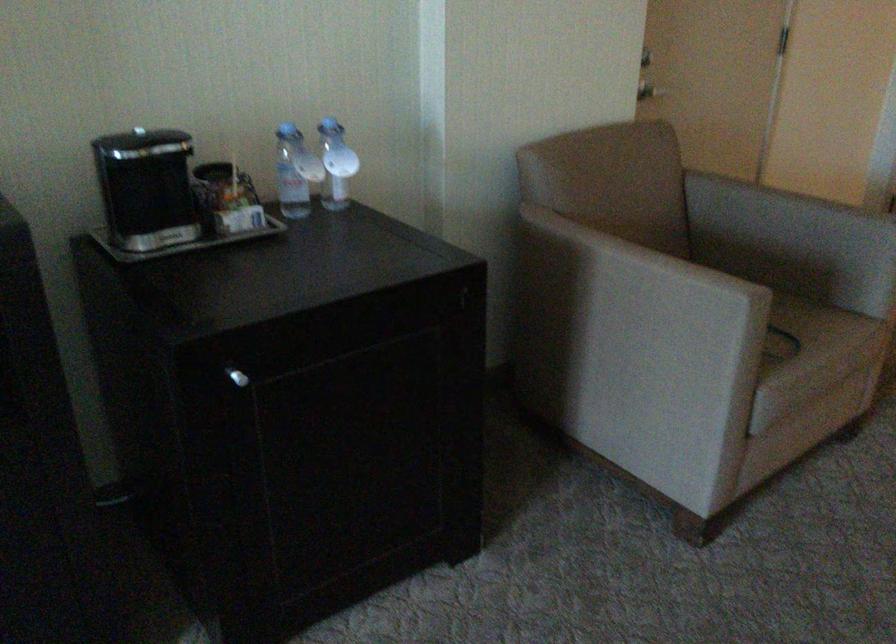
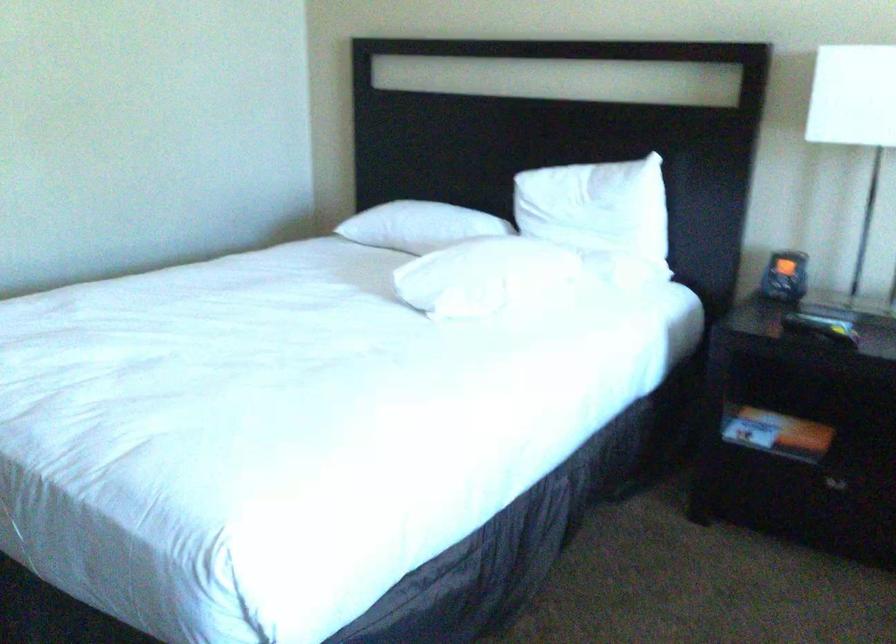
The images are taken continuously from a first-person perspective. In which direction is your viewpoint rotating?

The rotation direction of the camera is right-down.